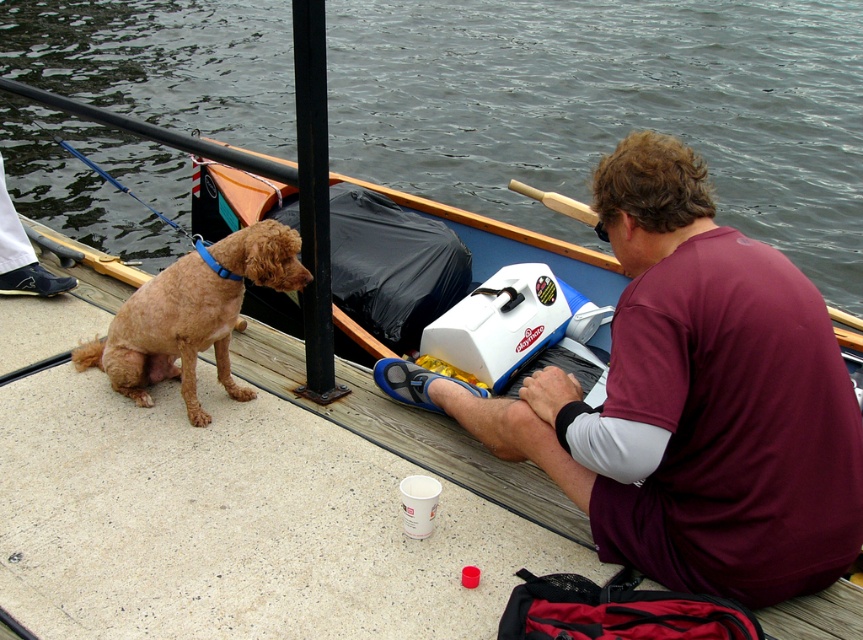
You are trying to determine if the maroon fabric shirt at center can be placed on the smooth concrete dock at center. Based on their sizes, is this possible?

The maroon fabric shirt at center occupies less space than the smooth concrete dock at center, so it can be placed on it.

You are standing on the dock and want to place a small potted plant exactly at the point marked by coordinates point (307, 513). According to the scene description, what surface will the potted plant be placed on?

The point marked by coordinates point (307, 513) is on the smooth concrete dock at center, so the potted plant will be placed on the smooth concrete dock at center.